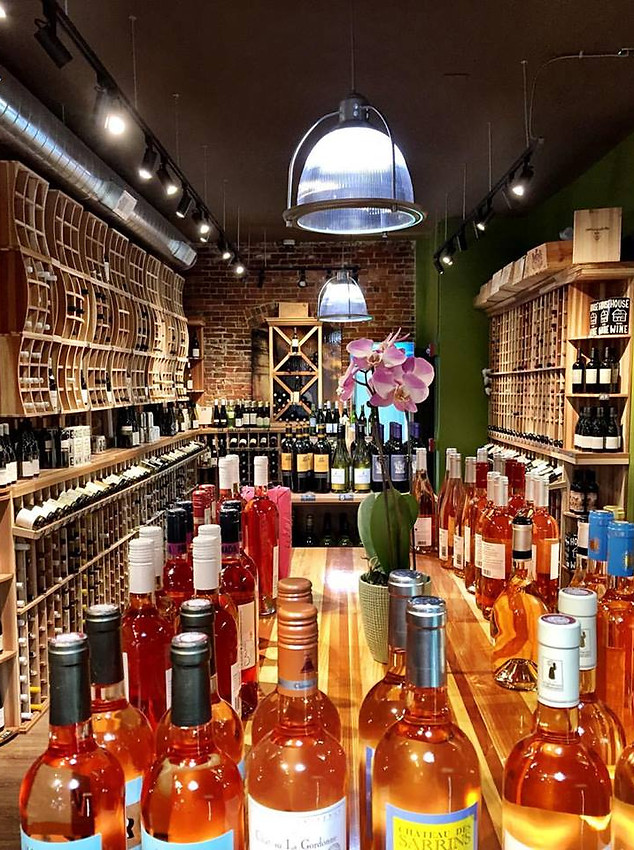
Where is `cork`? Image resolution: width=634 pixels, height=850 pixels. cork is located at coordinates (66, 636), (101, 605), (198, 602), (189, 636).